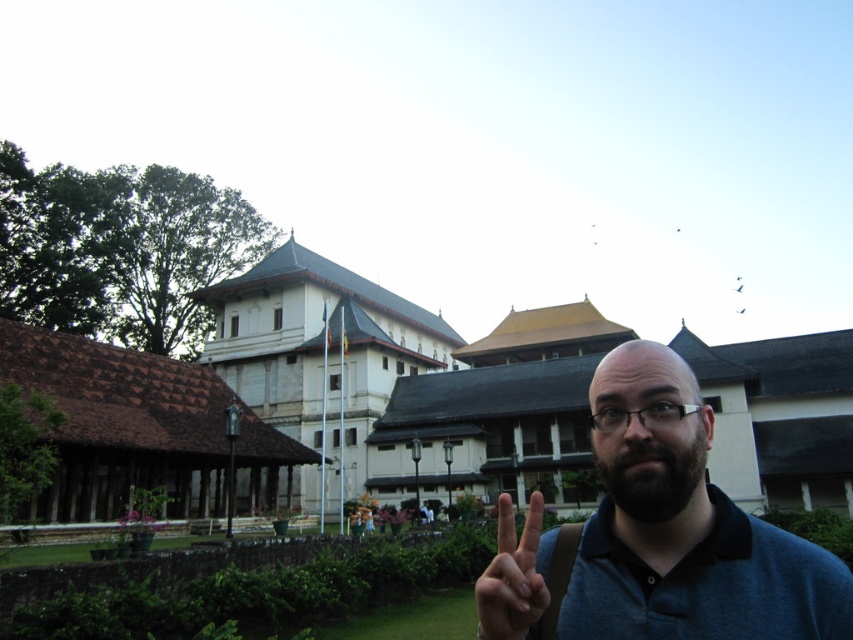
You are a tourist visiting this location and want to take a photo that includes both the white stone palace at upper left and the brown tiled roof at lower left. Which object should you position closer to the center of your camera frame to ensure both are visible in the photo?

You should position the brown tiled roof at lower left closer to the center of your camera frame because it is smaller than the white stone palace at upper left, allowing both to fit within the frame.

You are a photographer trying to capture a portrait of the person in the scene. You notice the dark blue shirt at center and the dark brown thick beard at center. Which object should you focus on first if you want to ensure both are in frame but prioritize the facial features?

You should focus on the dark brown thick beard at center first because it is to the left of the dark blue shirt at center, making it closer to the main focal point of the face.

You are a photographer trying to capture the person in the scene. The person is standing with their dark blue shirt at center and dark brown thick beard at center. Which object is located higher up on the person?

The dark brown thick beard at center is located higher up on the person because the dark blue shirt at center is below it.